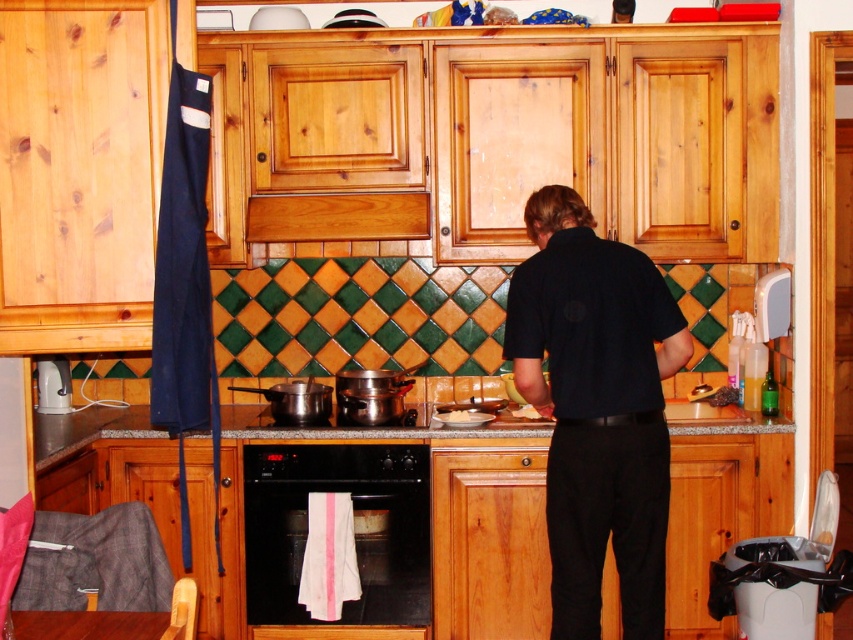
Consider the image. You are a chef preparing to place a new utensil on the granite gray counter top at center. However, there is a black matte shirt at center in the way. Can you place the utensil directly on the counter top without moving the shirt?

The black matte shirt at center is in front of the granite gray counter top at center, so you can place the utensil on the exposed part of the granite gray counter top at center not covered by the shirt.

You are organizing the kitchen counter and need to place a new item between the black matte shirt at center and the white creamy food at center. Based on their positions, where should you place the new item?

The black matte shirt at center is to the right of the white creamy food at center, so you should place the new item between them, ensuring it is positioned to the left of the black matte shirt at center and to the right of the white creamy food at center.

You are planning to place a new microwave next to the black matte oven at center on the granite gray counter top at center. Considering their sizes, will the microwave fit next to the oven?

The black matte oven at center has a smaller size compared to the granite gray counter top at center, so there should be enough space to place the microwave next to the oven.